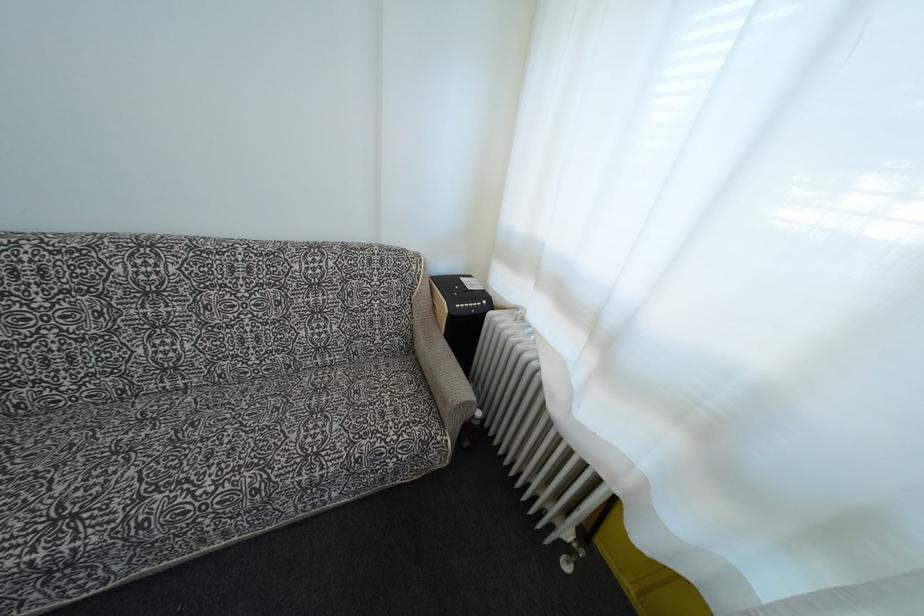
Locate an element on the screen. white radiator knob is located at coordinates (475, 422).